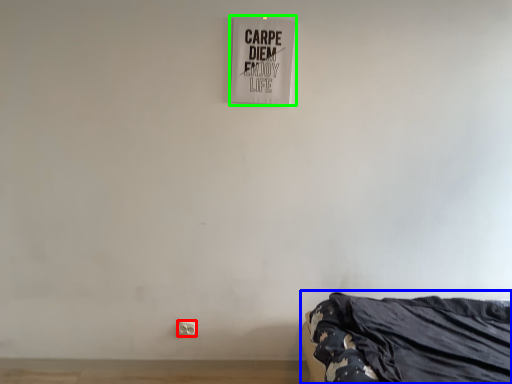
Question: Which is farther away from electric outlet (highlighted by a red box)? furniture (highlighted by a blue box) or signage (highlighted by a green box)?

Choices:
 (A) furniture
 (B) signage

Answer: (B)